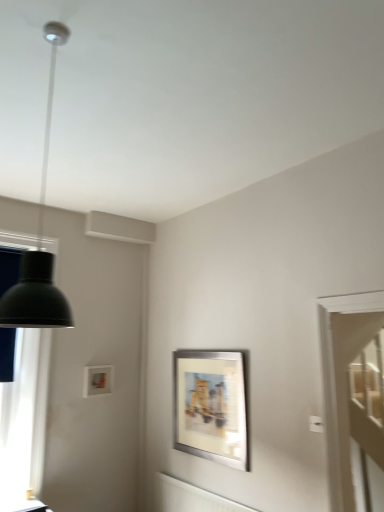
Question: Considering the relative sizes of silver metallic picture frame at center, the 1th picture frame viewed from the front, and matte black table at lower left in the image provided, is silver metallic picture frame at center, the 1th picture frame viewed from the front, wider than matte black table at lower left?

Choices:
 (A) no
 (B) yes

Answer: (A)

Question: Can you confirm if silver metallic picture frame at center, positioned as the 2th picture frame in back-to-front order, is bigger than matte black table at lower left?

Choices:
 (A) yes
 (B) no

Answer: (A)

Question: Is silver metallic picture frame at center, acting as the second picture frame starting from the left, positioned beyond the bounds of matte black table at lower left?

Choices:
 (A) yes
 (B) no

Answer: (A)

Question: Is silver metallic picture frame at center, the 1th picture frame viewed from the front, aimed at matte black table at lower left?

Choices:
 (A) yes
 (B) no

Answer: (A)

Question: Is the position of silver metallic picture frame at center, the 1th picture frame viewed from the front, less distant than that of matte black table at lower left?

Choices:
 (A) no
 (B) yes

Answer: (A)

Question: Is silver metallic picture frame at center, the 1th picture frame viewed from the front, directly adjacent to matte black table at lower left?

Choices:
 (A) no
 (B) yes

Answer: (A)

Question: Could you tell me if silver metallic picture frame at center, acting as the second picture frame starting from the left, is turned towards matte white picture frame at upper left, which ranks as the first picture frame in left-to-right order?

Choices:
 (A) yes
 (B) no

Answer: (B)

Question: Can matte white picture frame at upper left, which is counted as the second picture frame, starting from the front, be found inside silver metallic picture frame at center, the first picture frame in the right-to-left sequence?

Choices:
 (A) yes
 (B) no

Answer: (B)

Question: From the image's perspective, is silver metallic picture frame at center, acting as the second picture frame starting from the left, on top of matte white picture frame at upper left, which ranks as the first picture frame in left-to-right order?

Choices:
 (A) yes
 (B) no

Answer: (B)

Question: From a real-world perspective, is silver metallic picture frame at center, positioned as the 2th picture frame in back-to-front order, on matte white picture frame at upper left, which is counted as the second picture frame, starting from the front?

Choices:
 (A) no
 (B) yes

Answer: (A)

Question: Does silver metallic picture frame at center, acting as the second picture frame starting from the left, have a greater height compared to matte white picture frame at upper left, marked as the 1th picture frame in a back-to-front arrangement?

Choices:
 (A) no
 (B) yes

Answer: (B)

Question: Are silver metallic picture frame at center, acting as the second picture frame starting from the left, and matte white picture frame at upper left, which is counted as the second picture frame, starting from the front, beside each other?

Choices:
 (A) yes
 (B) no

Answer: (B)

Question: Is matte black lampshade at left smaller than matte white picture frame at upper left, which ranks as the second picture frame in right-to-left order?

Choices:
 (A) no
 (B) yes

Answer: (A)